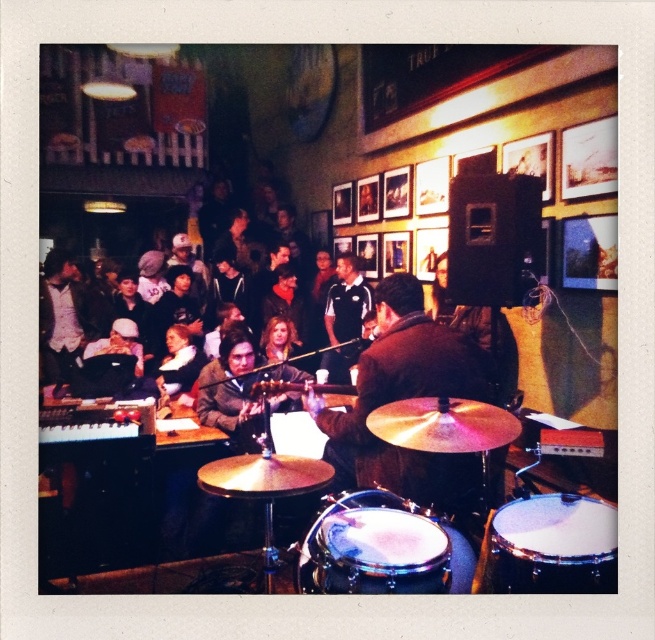
Question: Which of the following is the closest to the observer?

Choices:
 (A) white drumhead at center
 (B) shiny brown jacket at center
 (C) black jersey at center
 (D) shiny silver drum at center

Answer: (D)

Question: Observing the image, what is the correct spatial positioning of shiny brown jacket at center in reference to black jersey at center?

Choices:
 (A) below
 (B) above

Answer: (A)

Question: Can you confirm if shiny brown jacket at center is positioned above white drumhead at center?

Choices:
 (A) no
 (B) yes

Answer: (B)

Question: Does shiny brown jacket at center have a lesser width compared to white drumhead at center?

Choices:
 (A) no
 (B) yes

Answer: (A)

Question: Estimate the real-world distances between objects in this image. Which object is closer to the shiny silver drum at center?

Choices:
 (A) shiny brown jacket at center
 (B) white drumhead at center
 (C) black jersey at center

Answer: (B)

Question: Which point appears closest to the camera in this image?

Choices:
 (A) (333, 371)
 (B) (375, 509)

Answer: (B)